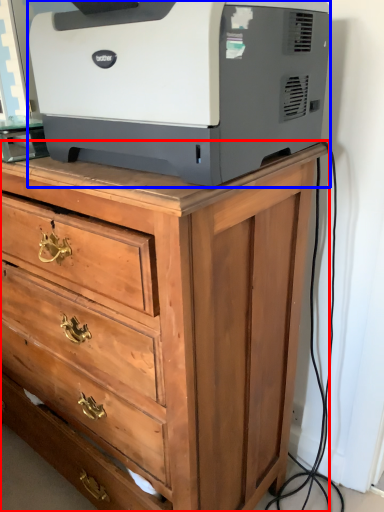
Question: Among these objects, which one is nearest to the camera, chest of drawers (highlighted by a red box) or printer (highlighted by a blue box)?

Choices:
 (A) chest of drawers
 (B) printer

Answer: (B)